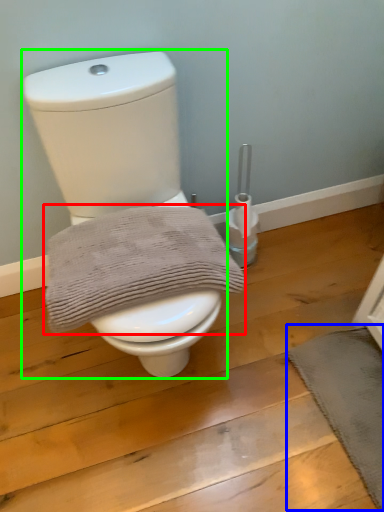
Question: Which object is positioned farthest from bath towel (highlighted by a red box)? Select from bath mat (highlighted by a blue box) and toilet (highlighted by a green box).

Choices:
 (A) bath mat
 (B) toilet

Answer: (A)